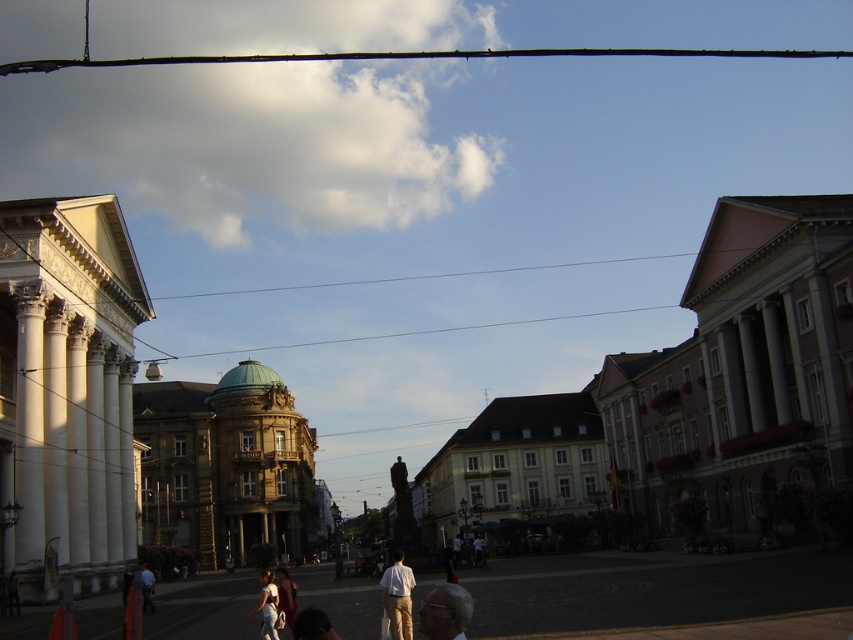
Is light blue shirt at lower left to the right of dark blue jeans at lower center from the viewer's perspective?

Indeed, light blue shirt at lower left is positioned on the right side of dark blue jeans at lower center.

Does light blue shirt at lower left appear over dark blue jeans at lower center?

No.

The height and width of the screenshot is (640, 853). What are the coordinates of `light blue shirt at lower left` in the screenshot? It's located at (146, 588).

Can you confirm if gray fabric head at lower center is bigger than white cotton shirt at lower center?

Actually, gray fabric head at lower center might be smaller than white cotton shirt at lower center.

Measure the distance between point [432,628] and camera.

The distance of point [432,628] from camera is 42.94 meters.

The height and width of the screenshot is (640, 853). Identify the location of gray fabric head at lower center. (445, 612).

Between white stone building at center and white matte shirt at center, which one has less height?

white matte shirt at center is shorter.

Does white stone building at center have a smaller size compared to white matte shirt at center?

Actually, white stone building at center might be larger than white matte shirt at center.

The height and width of the screenshot is (640, 853). Describe the element at coordinates (128, 420) in the screenshot. I see `white stone building at center` at that location.

Where is `white stone building at center`? Image resolution: width=853 pixels, height=640 pixels. white stone building at center is located at coordinates (128, 420).